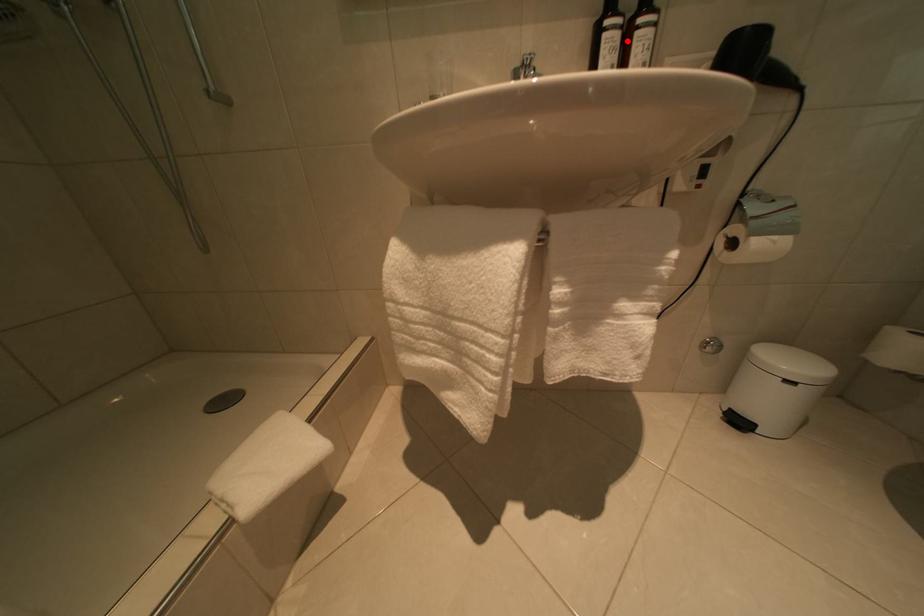
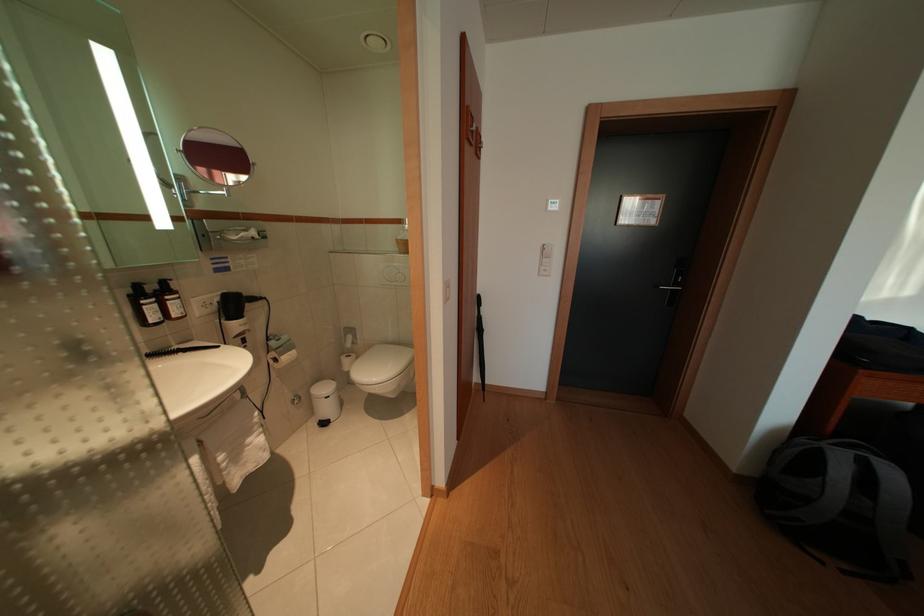
Where in the second image is the point corresponding to the highlighted location from the first image?

(164, 312)